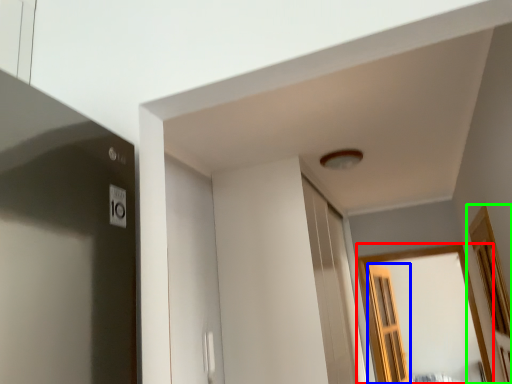
Question: Based on their relative distances, which object is nearer to window (highlighted by a red box)? Choose from screen door (highlighted by a blue box) and window (highlighted by a green box).

Choices:
 (A) screen door
 (B) window

Answer: (A)